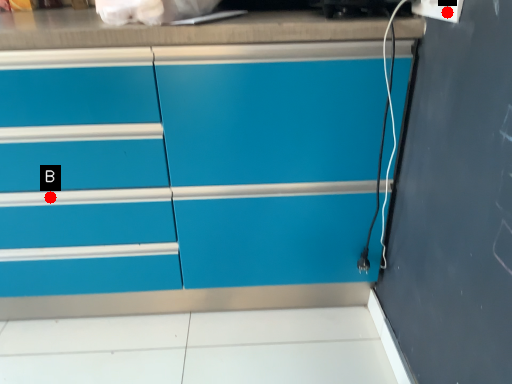
Question: Two points are circled on the image, labeled by A and B beside each circle. Among these points, which one is nearest to the camera?

Choices:
 (A) A is closer
 (B) B is closer

Answer: (A)